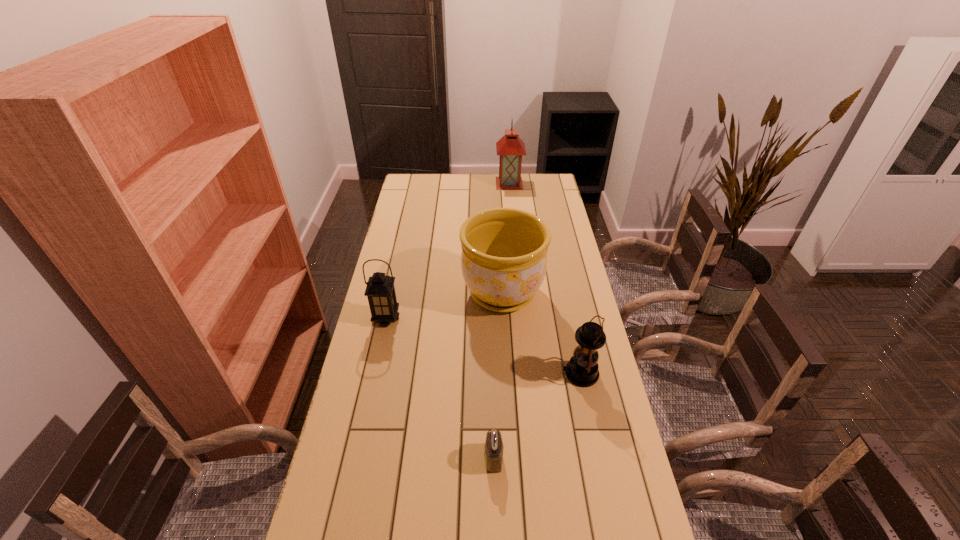
Identify the location of vacant region located 0.170m on the left of the flowerpot. 417,293.

The height and width of the screenshot is (540, 960). What are the coordinates of `vacant point located on the right of the leftmost object` in the screenshot? It's located at (450, 319).

Where is a free space located above the rightmost lantern, indicating its light source? Please provide its 2D coordinates. Your answer should be formatted as a tuple, i.e. [(x, y)], where the tuple contains the x and y coordinates of a point satisfying the conditions above.

[(490, 374)]

Identify a few spots in the free region located 0.230m above the rightmost lantern, indicating its light source. Please provide its 2D coordinates. Your answer should be formatted as a tuple, i.e. [(x, y)], where the tuple contains the x and y coordinates of a point satisfying the conditions above.

[(490, 374)]

Pinpoint the vacant space located 0.070m above the rightmost lantern, indicating its light source. Please provide its 2D coordinates. Your answer should be formatted as a tuple, i.e. [(x, y)], where the tuple contains the x and y coordinates of a point satisfying the conditions above.

[(540, 374)]

Find the location of a particular element. This screenshot has height=540, width=960. vacant space located 0.090m at the front of the nearest object near the keyhole is located at coordinates (451, 458).

Find the location of a particular element. This screenshot has height=540, width=960. free space located 0.180m at the front of the nearest object near the keyhole is located at coordinates (418, 458).

The width and height of the screenshot is (960, 540). What are the coordinates of `vacant space located 0.150m at the front of the nearest object near the keyhole` in the screenshot? It's located at (428, 458).

Locate an element on the screen. The height and width of the screenshot is (540, 960). object present at the far edge is located at coordinates (510, 147).

At what (x,y) coordinates should I click in order to perform the action: click on object positioned at the left edge. Please return your answer as a coordinate pair (x, y). Looking at the image, I should click on (380, 291).